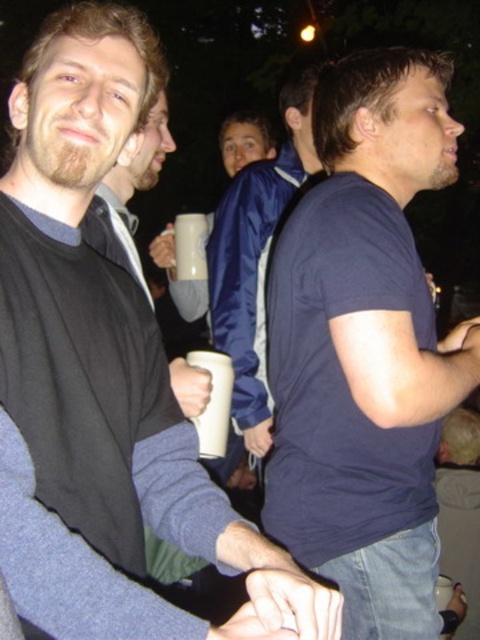
Question: Which object is positioned farthest from the dark blue t-shirt at center?

Choices:
 (A) white matte mug at center
 (B) matte black jacket at left

Answer: (A)

Question: Considering the relative positions of matte black shirt at center and matte black jacket at left in the image provided, where is matte black shirt at center located with respect to matte black jacket at left?

Choices:
 (A) left
 (B) right

Answer: (B)

Question: Which of these objects is positioned farthest from the dark blue t-shirt at center?

Choices:
 (A) blue fabric jacket at center
 (B) matte black shirt at center

Answer: (A)

Question: Which of the following is the closest to the observer?

Choices:
 (A) matte black jacket at left
 (B) white matte cup at center

Answer: (A)

Question: Does blue fabric jacket at center appear on the right side of matte black jacket at left?

Choices:
 (A) no
 (B) yes

Answer: (B)

Question: Can you confirm if matte black shirt at center is positioned above white matte cup at center?

Choices:
 (A) yes
 (B) no

Answer: (A)